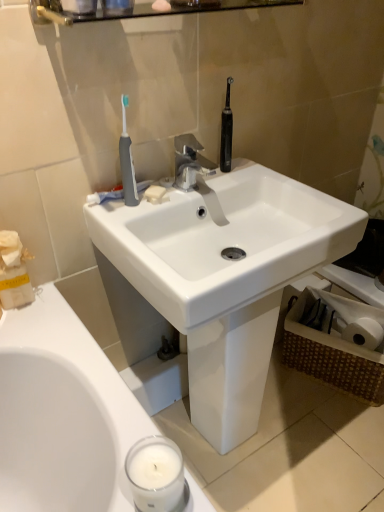
Question: Considering the relative positions of glossy glass shelf at upper center and white glossy sink at center in the image provided, is glossy glass shelf at upper center in front of white glossy sink at center?

Choices:
 (A) no
 (B) yes

Answer: (B)

Question: Considering the relative positions of glossy glass shelf at upper center and white glossy sink at center in the image provided, is glossy glass shelf at upper center to the right of white glossy sink at center from the viewer's perspective?

Choices:
 (A) no
 (B) yes

Answer: (A)

Question: Is glossy glass shelf at upper center surrounding white glossy sink at center?

Choices:
 (A) yes
 (B) no

Answer: (B)

Question: From the image's perspective, is glossy glass shelf at upper center on white glossy sink at center?

Choices:
 (A) yes
 (B) no

Answer: (A)

Question: From the image's perspective, is glossy glass shelf at upper center below white glossy sink at center?

Choices:
 (A) no
 (B) yes

Answer: (A)

Question: Is glossy glass shelf at upper center positioned far away from white glossy sink at center?

Choices:
 (A) no
 (B) yes

Answer: (A)

Question: Is white glossy sink at center looking in the opposite direction of silver metallic faucet at center?

Choices:
 (A) no
 (B) yes

Answer: (A)

Question: Can you confirm if white glossy sink at center is taller than silver metallic faucet at center?

Choices:
 (A) no
 (B) yes

Answer: (B)

Question: Are white glossy sink at center and silver metallic faucet at center located far from each other?

Choices:
 (A) yes
 (B) no

Answer: (B)

Question: From a real-world perspective, is white glossy sink at center located higher than silver metallic faucet at center?

Choices:
 (A) no
 (B) yes

Answer: (A)

Question: From the image's perspective, is white glossy sink at center under silver metallic faucet at center?

Choices:
 (A) no
 (B) yes

Answer: (B)

Question: Can you confirm if white glossy sink at center is thinner than silver metallic faucet at center?

Choices:
 (A) no
 (B) yes

Answer: (A)

Question: From a real-world perspective, is gray rubber toothbrush at upper left physically above glossy glass shelf at upper center?

Choices:
 (A) no
 (B) yes

Answer: (A)